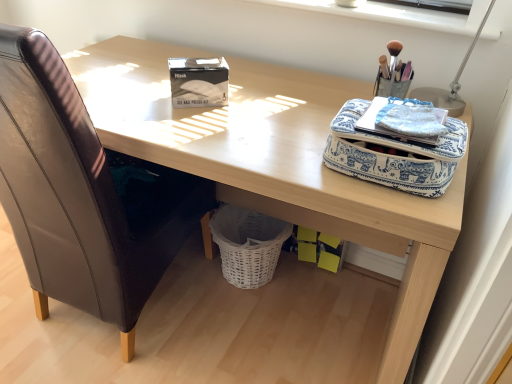
Locate an element on the screen. blank space to the left of blue printed fabric bag at upper right is located at coordinates (276, 143).